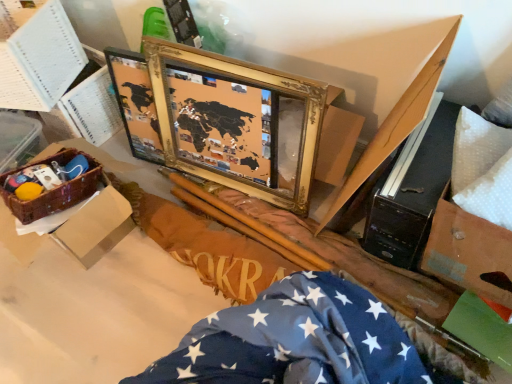
What do you see at coordinates (96, 227) in the screenshot? The height and width of the screenshot is (384, 512). I see `brown woven basket at left, the 2th box positioned from the top` at bounding box center [96, 227].

What do you see at coordinates (237, 122) in the screenshot? I see `gold/gilded picture frame at center` at bounding box center [237, 122].

The height and width of the screenshot is (384, 512). I want to click on blue fabric with white stars at lower right, so click(295, 340).

This screenshot has height=384, width=512. What are the coordinates of `woven brown basket at lower left` in the screenshot? It's located at (54, 189).

This screenshot has height=384, width=512. Identify the location of brown woven basket at left, which appears as the first box when ordered from the bottom. [96, 227].

Is woven brown basket at lower left positioned with its back to white paper at upper left, positioned as the 1th box in top-to-bottom order?

That's not correct — woven brown basket at lower left is not looking away from white paper at upper left, positioned as the 1th box in top-to-bottom order.

Is woven brown basket at lower left in contact with white paper at upper left, which appears as the 2th box when ordered from the bottom?

No, woven brown basket at lower left is not next to white paper at upper left, which appears as the 2th box when ordered from the bottom.

Considering the relative positions of woven brown basket at lower left and white paper at upper left, positioned as the 1th box in top-to-bottom order, in the image provided, is woven brown basket at lower left behind white paper at upper left, positioned as the 1th box in top-to-bottom order,?

That is False.

In order to click on crate located on the right of white paper at upper left, positioned as the 1th box in top-to-bottom order in this screenshot , I will do `click(54, 189)`.

Are white paper at upper left, which appears as the 2th box when ordered from the bottom, and blue fabric with white stars at lower right beside each other?

No, white paper at upper left, which appears as the 2th box when ordered from the bottom, is not with blue fabric with white stars at lower right.

Does white paper at upper left, which appears as the 2th box when ordered from the bottom, turn towards blue fabric with white stars at lower right?

No, white paper at upper left, which appears as the 2th box when ordered from the bottom, is not turned towards blue fabric with white stars at lower right.

Between white paper at upper left, which appears as the 2th box when ordered from the bottom, and blue fabric with white stars at lower right, which one has smaller size?

white paper at upper left, which appears as the 2th box when ordered from the bottom.

Looking at this image, from a real-world perspective, does white paper at upper left, positioned as the 1th box in top-to-bottom order, sit lower than blue fabric with white stars at lower right?

No, from a real-world perspective, white paper at upper left, positioned as the 1th box in top-to-bottom order, is not beneath blue fabric with white stars at lower right.

Is brown woven basket at left, which appears as the first box when ordered from the bottom, turned away from woven brown basket at lower left?

brown woven basket at left, which appears as the first box when ordered from the bottom, is not turned away from woven brown basket at lower left.

Is the depth of brown woven basket at left, the 2th box positioned from the top, greater than that of woven brown basket at lower left?

No, the depth of brown woven basket at left, the 2th box positioned from the top, is less than that of woven brown basket at lower left.

Considering the relative sizes of brown woven basket at left, the 2th box positioned from the top, and woven brown basket at lower left in the image provided, is brown woven basket at left, the 2th box positioned from the top, smaller than woven brown basket at lower left?

No.

Is the surface of brown woven basket at left, the 2th box positioned from the top, in direct contact with gold/gilded picture frame at center?

They are not placed beside each other.

Considering the relative positions of brown woven basket at left, the 2th box positioned from the top, and gold/gilded picture frame at center in the image provided, is brown woven basket at left, the 2th box positioned from the top, in front of gold/gilded picture frame at center?

No, the depth of brown woven basket at left, the 2th box positioned from the top, is greater than that of gold/gilded picture frame at center.

You are a GUI agent. You are given a task and a screenshot of the screen. Output one action in this format:
    pyautogui.click(x=<x>, y=<y>)
    Task: Click on the 1st box behind when counting from the gold/gilded picture frame at center
    The image size is (512, 384).
    Given the screenshot: What is the action you would take?
    click(x=96, y=227)

Measure the distance from brown woven basket at left, which appears as the first box when ordered from the bottom, to gold/gilded picture frame at center.

They are 19.23 inches apart.

In the scene shown: Does brown woven basket at left, the 2th box positioned from the top, appear on the left side of white paper at upper left, which appears as the 2th box when ordered from the bottom?

No, brown woven basket at left, the 2th box positioned from the top, is not to the left of white paper at upper left, which appears as the 2th box when ordered from the bottom.

Would you say white paper at upper left, positioned as the 1th box in top-to-bottom order, is part of brown woven basket at left, the 2th box positioned from the top,'s contents?

No, white paper at upper left, positioned as the 1th box in top-to-bottom order, is not a part of brown woven basket at left, the 2th box positioned from the top.

How different are the orientations of brown woven basket at left, the 2th box positioned from the top, and white paper at upper left, which appears as the 2th box when ordered from the bottom, in degrees?

25.3 degrees.

What's the angular difference between gold/gilded picture frame at center and woven brown basket at lower left's facing directions?

The facing directions of gold/gilded picture frame at center and woven brown basket at lower left are 15.8 degrees apart.

From the image's perspective, is gold/gilded picture frame at center located above or below woven brown basket at lower left?

gold/gilded picture frame at center is situated higher than woven brown basket at lower left in the image.

From a real-world perspective, is gold/gilded picture frame at center on top of woven brown basket at lower left?

No.

From the image's perspective, between woven brown basket at lower left and gold/gilded picture frame at center, which one is located above?

gold/gilded picture frame at center appears higher in the image.

Can you confirm if woven brown basket at lower left is bigger than gold/gilded picture frame at center?

No, woven brown basket at lower left is not bigger than gold/gilded picture frame at center.

Is woven brown basket at lower left taller than gold/gilded picture frame at center?

In fact, woven brown basket at lower left may be shorter than gold/gilded picture frame at center.

Looking at this image, which object is positioned more to the right, woven brown basket at lower left or gold/gilded picture frame at center?

Positioned to the right is gold/gilded picture frame at center.

The width and height of the screenshot is (512, 384). Find the location of `crate located on the right of white paper at upper left, which appears as the 2th box when ordered from the bottom`. crate located on the right of white paper at upper left, which appears as the 2th box when ordered from the bottom is located at coordinates (54, 189).

The image size is (512, 384). I want to click on flag that appears in front of the white paper at upper left, positioned as the 1th box in top-to-bottom order, so click(295, 340).

Estimate the real-world distances between objects in this image. Which object is further from woven brown basket at lower left, gold/gilded picture frame at center or white paper at upper left, positioned as the 1th box in top-to-bottom order?

gold/gilded picture frame at center is further to woven brown basket at lower left.

Which object lies further to the anchor point brown woven basket at left, the 2th box positioned from the top, white paper at upper left, positioned as the 1th box in top-to-bottom order, or gold/gilded picture frame at center?

Among the two, gold/gilded picture frame at center is located further to brown woven basket at left, the 2th box positioned from the top.

Looking at the image, which one is located further to blue fabric with white stars at lower right, gold/gilded picture frame at center or brown woven basket at left, the 2th box positioned from the top?

brown woven basket at left, the 2th box positioned from the top.

Estimate the real-world distances between objects in this image. Which object is closer to white paper at upper left, which appears as the 2th box when ordered from the bottom, woven brown basket at lower left or gold/gilded picture frame at center?

Based on the image, woven brown basket at lower left appears to be nearer to white paper at upper left, which appears as the 2th box when ordered from the bottom.

Looking at this image, estimate the real-world distances between objects in this image. Which object is closer to blue fabric with white stars at lower right, woven brown basket at lower left or gold/gilded picture frame at center?

A: gold/gilded picture frame at center lies closer to blue fabric with white stars at lower right than the other object.

In the scene shown: When comparing their distances from brown woven basket at left, the 2th box positioned from the top, does blue fabric with white stars at lower right or woven brown basket at lower left seem closer?

Based on the image, woven brown basket at lower left appears to be nearer to brown woven basket at left, the 2th box positioned from the top.

From the image, which object appears to be farther from white paper at upper left, which appears as the 2th box when ordered from the bottom, gold/gilded picture frame at center or woven brown basket at lower left?

gold/gilded picture frame at center is further to white paper at upper left, which appears as the 2th box when ordered from the bottom.

Based on their spatial positions, is blue fabric with white stars at lower right or white paper at upper left, which appears as the 2th box when ordered from the bottom, closer to woven brown basket at lower left?

Based on the image, white paper at upper left, which appears as the 2th box when ordered from the bottom, appears to be nearer to woven brown basket at lower left.

You are a GUI agent. You are given a task and a screenshot of the screen. Output one action in this format:
    pyautogui.click(x=<x>, y=<y>)
    Task: Click on the box located between white paper at upper left, which appears as the 2th box when ordered from the bottom, and gold/gilded picture frame at center in the left-right direction
    
    Given the screenshot: What is the action you would take?
    pyautogui.click(x=96, y=227)

I want to click on crate that lies between white paper at upper left, which appears as the 2th box when ordered from the bottom, and brown woven basket at left, the 2th box positioned from the top, from top to bottom, so click(54, 189).

Identify the location of picture frame located between brown woven basket at left, which appears as the first box when ordered from the bottom, and blue fabric with white stars at lower right in the left-right direction. The image size is (512, 384). (237, 122).

At what (x,y) coordinates should I click in order to perform the action: click on box between woven brown basket at lower left and gold/gilded picture frame at center. Please return your answer as a coordinate pair (x, y). This screenshot has width=512, height=384. Looking at the image, I should click on (x=96, y=227).